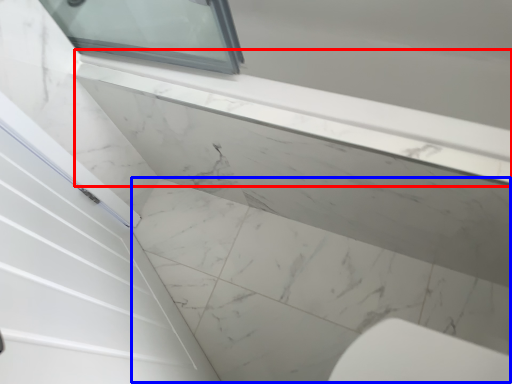
Question: Which object appears farthest to the camera in this image, window sill (highlighted by a red box) or concrete (highlighted by a blue box)?

Choices:
 (A) window sill
 (B) concrete

Answer: (B)